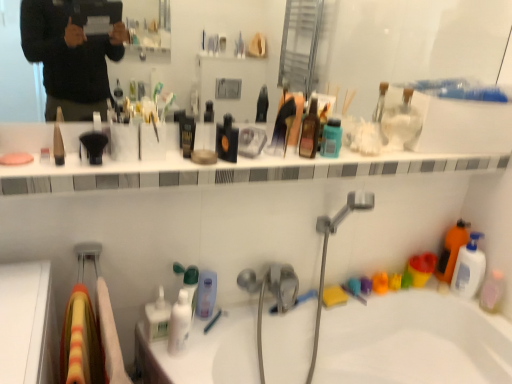
Locate an element on the screen. This screenshot has width=512, height=384. vacant space to the right of teal plastic mouthwash at center, positioned as the 3th mouthwash in back-to-front order is located at coordinates (368, 159).